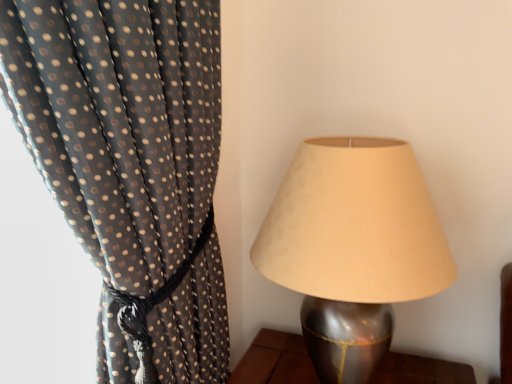
Question: Would you say black sheer fabric with gold dots at left is inside or outside metallic silver lampshade at right?

Choices:
 (A) inside
 (B) outside

Answer: (B)

Question: Considering their positions, is black sheer fabric with gold dots at left located in front of or behind metallic silver lampshade at right?

Choices:
 (A) front
 (B) behind

Answer: (A)

Question: Based on their sizes in the image, would you say black sheer fabric with gold dots at left is bigger or smaller than metallic silver lampshade at right?

Choices:
 (A) big
 (B) small

Answer: (A)

Question: Considering the relative positions of metallic silver lampshade at right and black sheer fabric with gold dots at left in the image provided, is metallic silver lampshade at right to the left or to the right of black sheer fabric with gold dots at left?

Choices:
 (A) left
 (B) right

Answer: (B)

Question: From their relative heights in the image, would you say metallic silver lampshade at right is taller or shorter than black sheer fabric with gold dots at left?

Choices:
 (A) short
 (B) tall

Answer: (A)

Question: In terms of width, does metallic silver lampshade at right look wider or thinner when compared to black sheer fabric with gold dots at left?

Choices:
 (A) wide
 (B) thin

Answer: (B)

Question: Would you say metallic silver lampshade at right is inside or outside black sheer fabric with gold dots at left?

Choices:
 (A) outside
 (B) inside

Answer: (A)